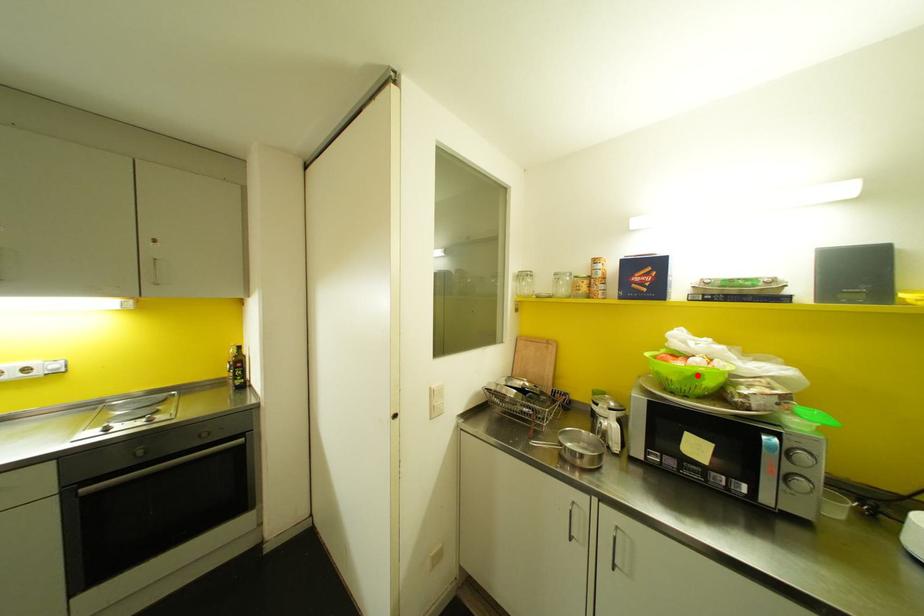
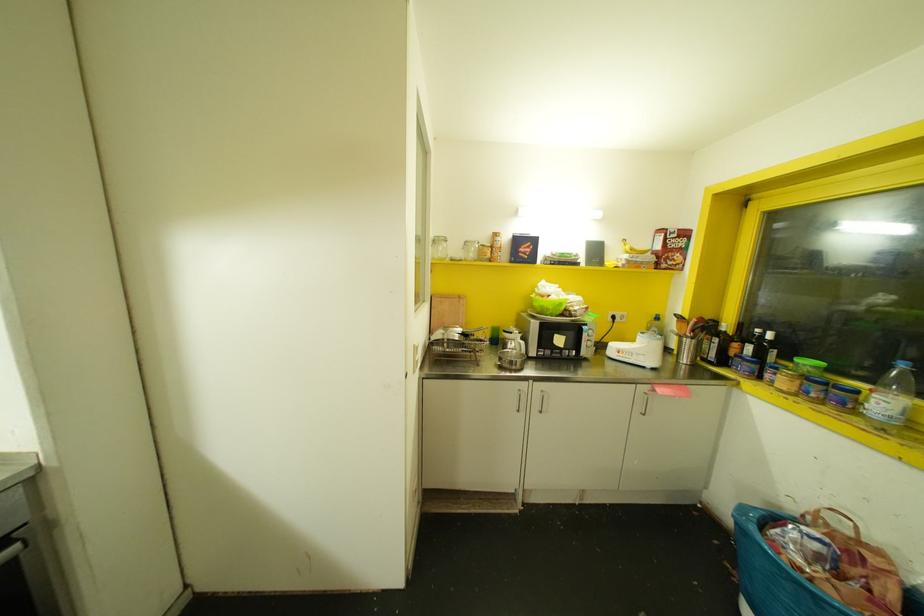
Find the pixel in the second image that matches the highlighted location in the first image.

(560, 304)